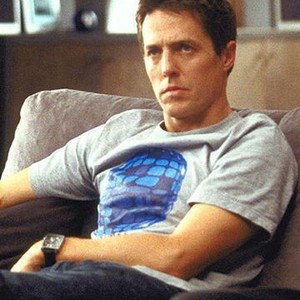
Locate an element on the screen. This screenshot has width=300, height=300. gray sofa is located at coordinates (72, 105).